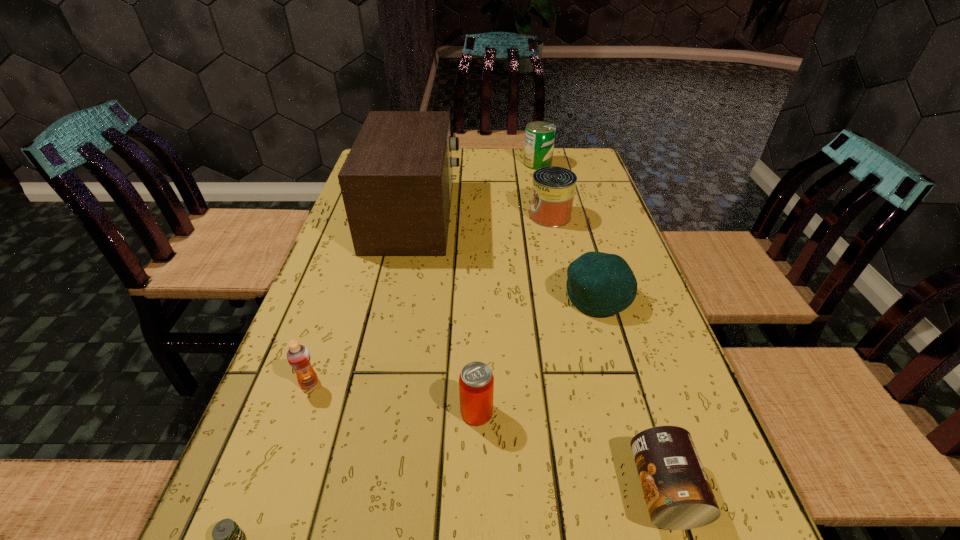
Find the location of a particular element. The height and width of the screenshot is (540, 960). vacant space that is in between the shortest can and the leftmost can is located at coordinates (570, 451).

The height and width of the screenshot is (540, 960). In order to click on unoccupied position between the fourth nearest object and the fifth nearest object in this screenshot , I will do `click(453, 340)`.

Locate an element on the screen. The height and width of the screenshot is (540, 960). free space between the shortest can and the farthest can is located at coordinates (601, 327).

Choose which object is the second nearest neighbor to the radio receiver. Please provide its 2D coordinates. Your answer should be formatted as a tuple, i.e. [(x, y)], where the tuple contains the x and y coordinates of a point satisfying the conditions above.

[(539, 137)]

Locate an element on the screen. The height and width of the screenshot is (540, 960). object that can be found as the second closest to the radio receiver is located at coordinates click(x=539, y=137).

Locate which can ranks in proximity to the second shortest object. Please provide its 2D coordinates. Your answer should be formatted as a tuple, i.e. [(x, y)], where the tuple contains the x and y coordinates of a point satisfying the conditions above.

[(476, 382)]

Locate which can ranks second in proximity to the farthest object. Please provide its 2D coordinates. Your answer should be formatted as a tuple, i.e. [(x, y)], where the tuple contains the x and y coordinates of a point satisfying the conditions above.

[(476, 382)]

Where is `free location that satisfies the following two spatial constraints: 1. on the front-facing side of the tallest object; 2. on the right side of the third nearest object`? free location that satisfies the following two spatial constraints: 1. on the front-facing side of the tallest object; 2. on the right side of the third nearest object is located at coordinates (373, 412).

Identify the location of free location that satisfies the following two spatial constraints: 1. on the back side of the fourth object from left to right; 2. on the left side of the second farthest can. This screenshot has width=960, height=540. (478, 216).